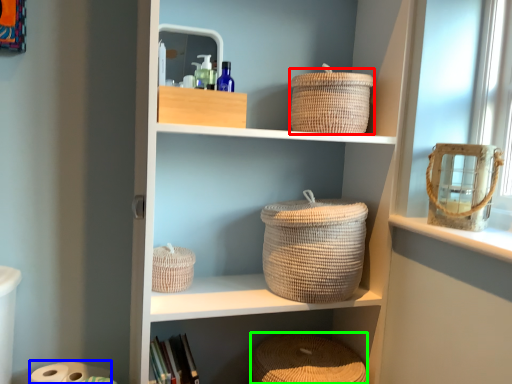
Question: Considering the real-world distances, which object is farthest from basket (highlighted by a red box)? toilet paper (highlighted by a blue box) or basket (highlighted by a green box)?

Choices:
 (A) toilet paper
 (B) basket

Answer: (A)